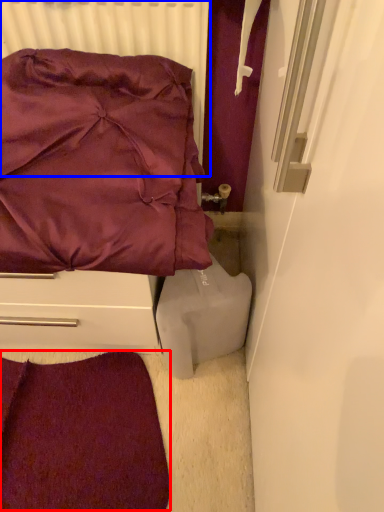
Question: Among these objects, which one is nearest to the camera, violet (highlighted by a red box) or radiator (highlighted by a blue box)?

Choices:
 (A) violet
 (B) radiator

Answer: (B)